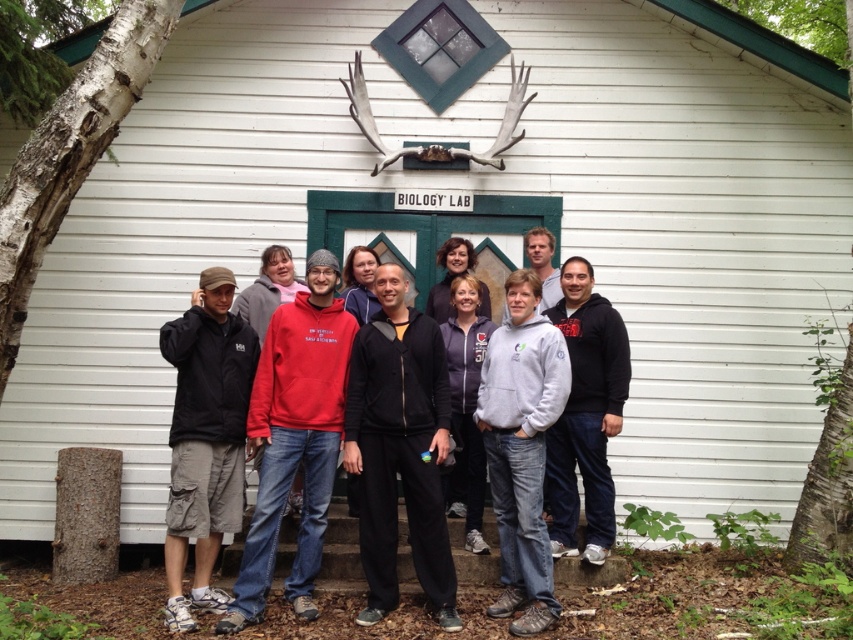
Question: Considering the relative positions of black matte jacket at center and dark gray cotton cargo shorts at lower left in the image provided, where is black matte jacket at center located with respect to dark gray cotton cargo shorts at lower left?

Choices:
 (A) right
 (B) left

Answer: (A)

Question: Which point is farther to the camera?

Choices:
 (A) dark gray hoodie at center
 (B) gray fleece jacket at center

Answer: (B)

Question: Which of the following is the closest to the observer?

Choices:
 (A) (177, 602)
 (B) (399, 465)

Answer: (A)

Question: Observing the image, what is the correct spatial positioning of dark gray cotton cargo shorts at lower left in reference to gray fleece jacket at center?

Choices:
 (A) above
 (B) below

Answer: (B)

Question: Is dark gray hoodie at center to the left of gray fleece jacket at center from the viewer's perspective?

Choices:
 (A) yes
 (B) no

Answer: (B)

Question: Which of the following is the closest to the observer?

Choices:
 (A) dark gray hoodie at center
 (B) gray fleece jacket at center
 (C) black matte jacket at center
 (D) dark gray cotton cargo shorts at lower left

Answer: (D)